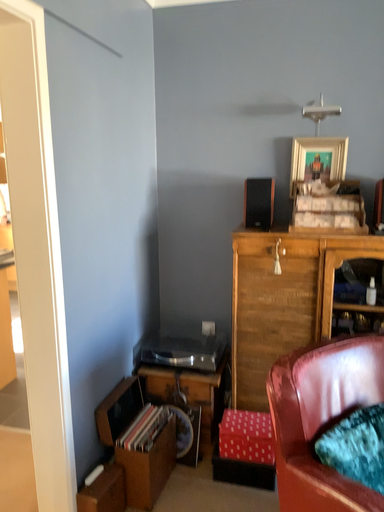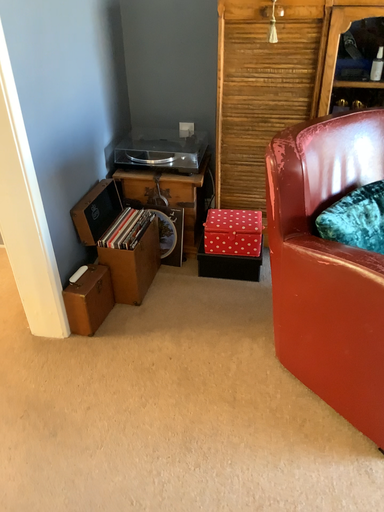
Question: Which way did the camera rotate in the video?

Choices:
 (A) rotated downward
 (B) rotated upward

Answer: (A)